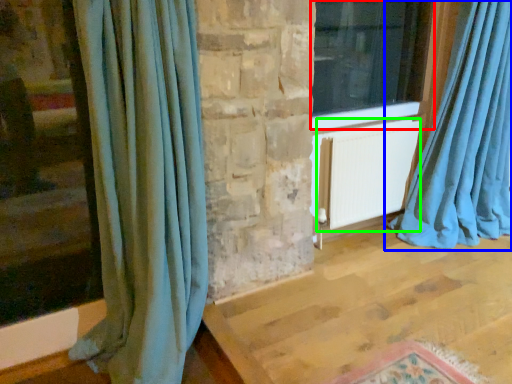
Question: Which object is the closest to the window (highlighted by a red box)? Choose among these: curtain (highlighted by a blue box) or radiator (highlighted by a green box).

Choices:
 (A) curtain
 (B) radiator

Answer: (B)